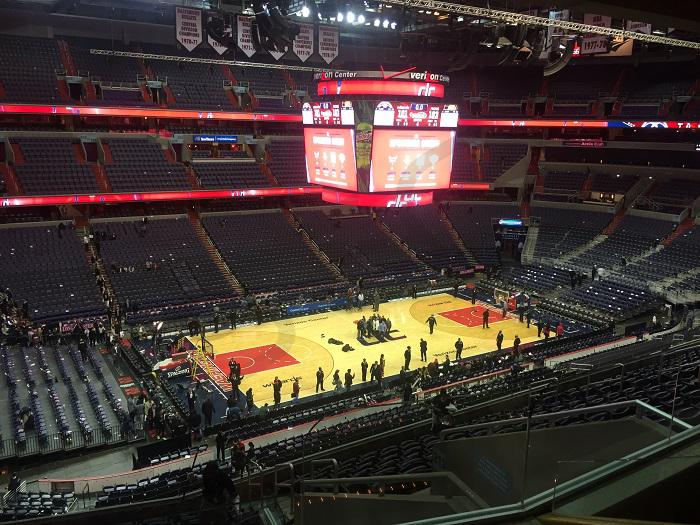
Identify the location of metal supports. (600, 32).